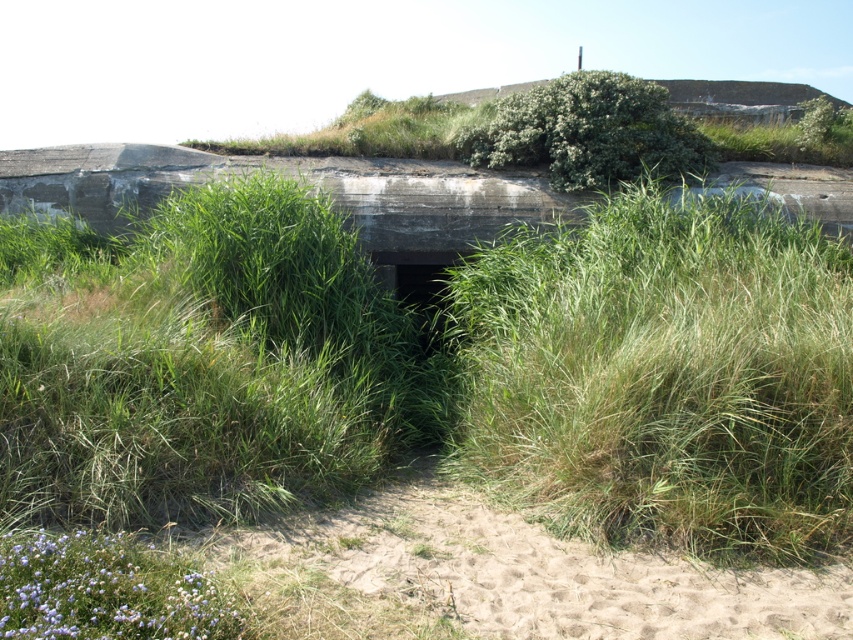
Question: Is purple soft flower at lower left positioned behind green leafy bush at upper center?

Choices:
 (A) no
 (B) yes

Answer: (A)

Question: Is purple soft flower at lower left positioned behind green leafy bush at upper center?

Choices:
 (A) yes
 (B) no

Answer: (B)

Question: Does purple soft flower at lower left appear over green leafy bush at upper center?

Choices:
 (A) no
 (B) yes

Answer: (A)

Question: Among these objects, which one is farthest from the camera?

Choices:
 (A) green leafy bush at upper center
 (B) purple soft flower at lower left

Answer: (A)